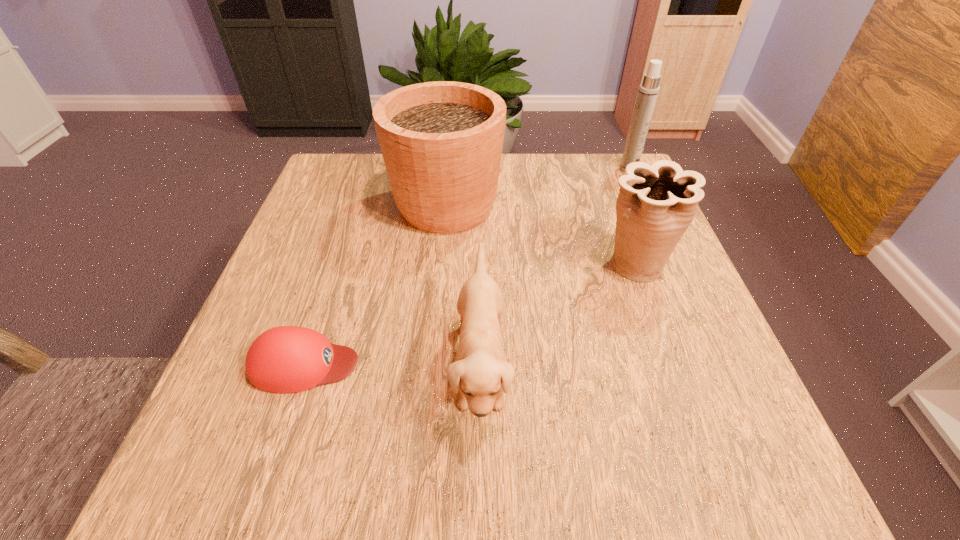
Find the location of a particular element. This screenshot has height=540, width=960. free space between the aerosol can and the flowerpot is located at coordinates (538, 187).

Where is `free spot between the second farthest object and the third farthest object`? The image size is (960, 540). free spot between the second farthest object and the third farthest object is located at coordinates (540, 235).

Find the location of `free space that is in between the second shortest object and the third tallest object`. free space that is in between the second shortest object and the third tallest object is located at coordinates [558, 316].

Identify which object is located as the nearest to the second farthest object. Please provide its 2D coordinates. Your answer should be formatted as a tuple, i.e. [(x, y)], where the tuple contains the x and y coordinates of a point satisfying the conditions above.

[(480, 374)]

Identify which object is located as the fourth nearest to the flowerpot. Please provide its 2D coordinates. Your answer should be formatted as a tuple, i.e. [(x, y)], where the tuple contains the x and y coordinates of a point satisfying the conditions above.

[(648, 91)]

The width and height of the screenshot is (960, 540). Identify the location of free space that satisfies the following two spatial constraints: 1. on the front side of the third tallest object; 2. on the left side of the puppy. (671, 366).